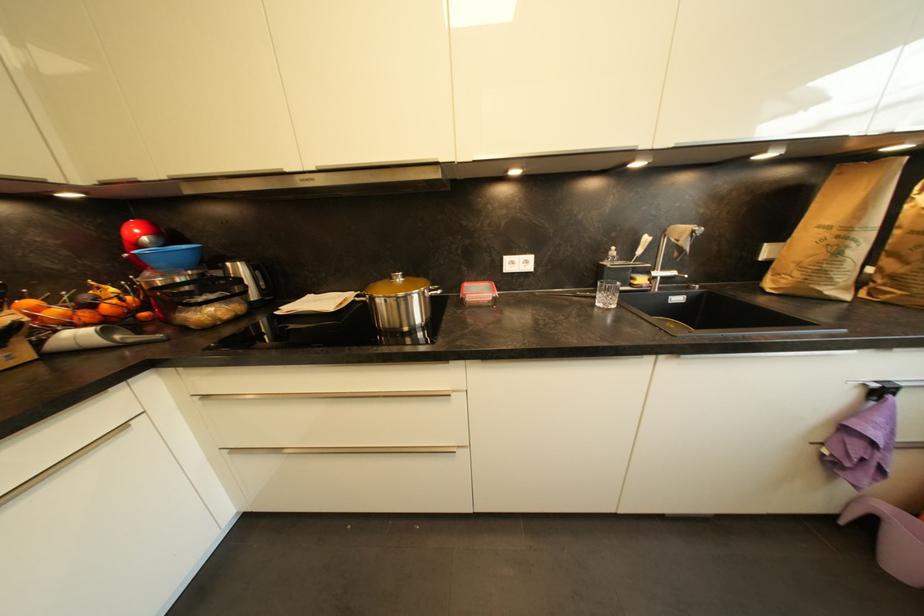
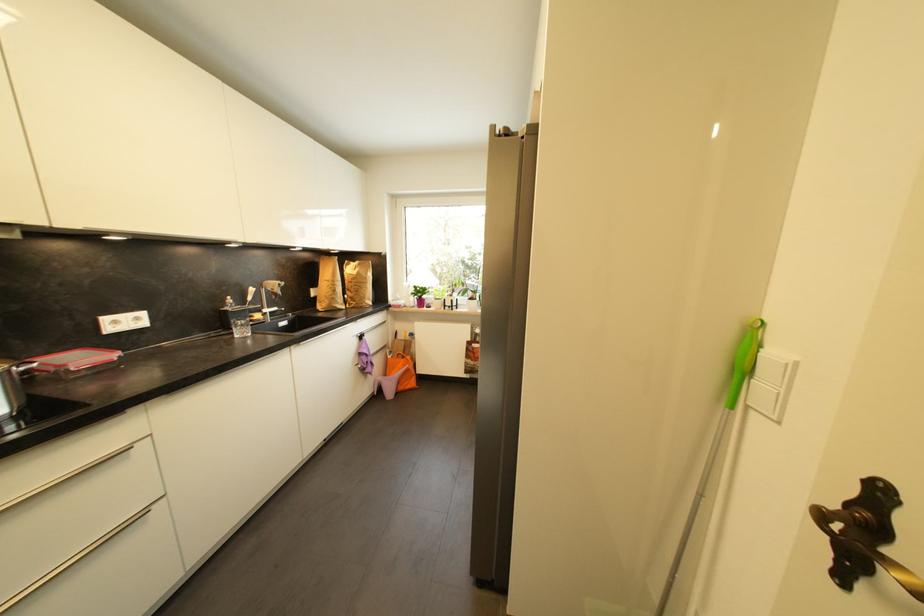
Find the pixel in the second image that matches [531,264] in the first image.

(142, 321)